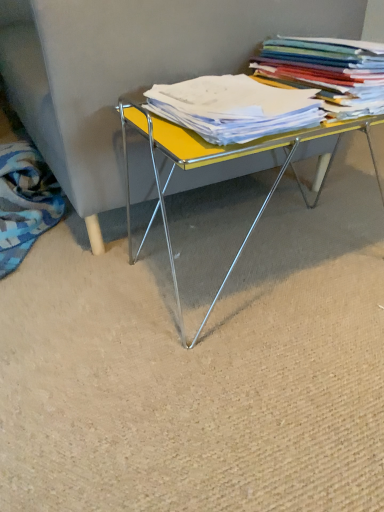
Describe the element at coordinates (234, 108) in the screenshot. I see `yellow matte paper at center` at that location.

Describe the element at coordinates (25, 202) in the screenshot. I see `blue patterned fabric at lower left` at that location.

The width and height of the screenshot is (384, 512). Find the location of `yellow glossy table at center`. yellow glossy table at center is located at coordinates (216, 162).

From the image's perspective, is blue patterned fabric at lower left above multicolored paper stack at upper right?

No, from the image's perspective, blue patterned fabric at lower left is not over multicolored paper stack at upper right.

Which of these two, blue patterned fabric at lower left or multicolored paper stack at upper right, is wider?

Wider between the two is blue patterned fabric at lower left.

What's the angular difference between blue patterned fabric at lower left and multicolored paper stack at upper right's facing directions?

There is a 0.776-degree angle between the facing directions of blue patterned fabric at lower left and multicolored paper stack at upper right.

Would you say blue patterned fabric at lower left contains multicolored paper stack at upper right?

Definitely not — multicolored paper stack at upper right is not inside blue patterned fabric at lower left.

Could yellow glossy table at center be considered to be inside multicolored paper stack at upper right?

No, yellow glossy table at center is not inside multicolored paper stack at upper right.

Considering the relative sizes of multicolored paper stack at upper right and yellow glossy table at center in the image provided, is multicolored paper stack at upper right taller than yellow glossy table at center?

Incorrect, the height of multicolored paper stack at upper right is not larger of that of yellow glossy table at center.

From the image's perspective, who appears lower, multicolored paper stack at upper right or yellow glossy table at center?

yellow glossy table at center appears lower in the image.

Is yellow glossy table at center facing away from blue patterned fabric at lower left?

yellow glossy table at center is not turned away from blue patterned fabric at lower left.

Which object is more forward, yellow glossy table at center or blue patterned fabric at lower left?

yellow glossy table at center is in front.

Is yellow glossy table at center outside of blue patterned fabric at lower left?

Indeed, yellow glossy table at center is completely outside blue patterned fabric at lower left.

From the image's perspective, relative to blue patterned fabric at lower left, is yellow glossy table at center above or below?

From the image's perspective, yellow glossy table at center appears below blue patterned fabric at lower left.

Can you confirm if yellow glossy table at center is taller than multicolored paper stack at upper right?

Yes, yellow glossy table at center is taller than multicolored paper stack at upper right.

Which of these two, yellow glossy table at center or multicolored paper stack at upper right, is wider?

Wider between the two is yellow glossy table at center.

Is yellow glossy table at center turned away from multicolored paper stack at upper right?

No, multicolored paper stack at upper right is not at the back of yellow glossy table at center.

From the image's perspective, between yellow glossy table at center and multicolored paper stack at upper right, who is located below?

yellow glossy table at center, from the image's perspective.

In the scene shown: How different are the orientations of yellow matte paper at center and blue patterned fabric at lower left in degrees?

0.05 degrees separate the facing orientations of yellow matte paper at center and blue patterned fabric at lower left.

Considering the relative positions of yellow matte paper at center and blue patterned fabric at lower left in the image provided, is yellow matte paper at center behind blue patterned fabric at lower left?

No, it is in front of blue patterned fabric at lower left.

Consider the image. Between yellow matte paper at center and blue patterned fabric at lower left, which one appears on the left side from the viewer's perspective?

Positioned to the left is blue patterned fabric at lower left.

Relative to yellow matte paper at center, is blue patterned fabric at lower left in front or behind?

In the image, blue patterned fabric at lower left appears behind yellow matte paper at center.

From the image's perspective, who appears lower, blue patterned fabric at lower left or yellow matte paper at center?

blue patterned fabric at lower left, from the image's perspective.

Is blue patterned fabric at lower left turned away from yellow matte paper at center?

blue patterned fabric at lower left does not have its back to yellow matte paper at center.

Which point is more distant from viewer, [176,101] or [168,141]?

Positioned behind is point [176,101].

Is yellow glossy table at center a part of yellow matte paper at center?

No.

From the image's perspective, does yellow matte paper at center appear higher than yellow glossy table at center?

Yes, from the image's perspective, yellow matte paper at center is over yellow glossy table at center.

What are the coordinates of `fabric below the multicolored paper stack at upper right (from the image's perspective)` in the screenshot? It's located at (25, 202).

Locate an element on the screen. This screenshot has height=512, width=384. book above the yellow glossy table at center (from a real-world perspective) is located at coordinates (328, 72).

Considering their positions, is yellow glossy table at center positioned closer to multicolored paper stack at upper right than blue patterned fabric at lower left?

yellow glossy table at center is positioned closer to the anchor multicolored paper stack at upper right.

From the image, which object appears to be farther from blue patterned fabric at lower left, yellow matte paper at center or yellow glossy table at center?

The object further to blue patterned fabric at lower left is yellow matte paper at center.

Based on the photo, estimate the real-world distances between objects in this image. Which object is closer to blue patterned fabric at lower left, yellow glossy table at center or yellow matte paper at center?

yellow glossy table at center lies closer to blue patterned fabric at lower left than the other object.

Considering their positions, is yellow glossy table at center positioned further to yellow matte paper at center than blue patterned fabric at lower left?

The object further to yellow matte paper at center is blue patterned fabric at lower left.

Looking at the image, which one is located closer to multicolored paper stack at upper right, yellow matte paper at center or yellow glossy table at center?

Among the two, yellow matte paper at center is located nearer to multicolored paper stack at upper right.

From the image, which object appears to be farther from blue patterned fabric at lower left, multicolored paper stack at upper right or yellow glossy table at center?

multicolored paper stack at upper right.

From the image, which object appears to be nearer to yellow glossy table at center, multicolored paper stack at upper right or blue patterned fabric at lower left?

The object closer to yellow glossy table at center is multicolored paper stack at upper right.

Which object lies nearer to the anchor point yellow matte paper at center, blue patterned fabric at lower left or multicolored paper stack at upper right?

multicolored paper stack at upper right is positioned closer to the anchor yellow matte paper at center.

Locate an element on the screen. The image size is (384, 512). magazine between multicolored paper stack at upper right and yellow glossy table at center from top to bottom is located at coordinates (234, 108).

At what (x,y) coordinates should I click in order to perform the action: click on magazine between blue patterned fabric at lower left and yellow glossy table at center from left to right. Please return your answer as a coordinate pair (x, y). This screenshot has width=384, height=512. Looking at the image, I should click on (234, 108).

You are a GUI agent. You are given a task and a screenshot of the screen. Output one action in this format:
    pyautogui.click(x=<x>, y=<y>)
    Task: Click on the magazine between blue patterned fabric at lower left and multicolored paper stack at upper right
    This screenshot has height=512, width=384.
    Given the screenshot: What is the action you would take?
    pyautogui.click(x=234, y=108)

The width and height of the screenshot is (384, 512). Find the location of `table between blue patterned fabric at lower left and multicolored paper stack at upper right from left to right`. table between blue patterned fabric at lower left and multicolored paper stack at upper right from left to right is located at coordinates (216, 162).